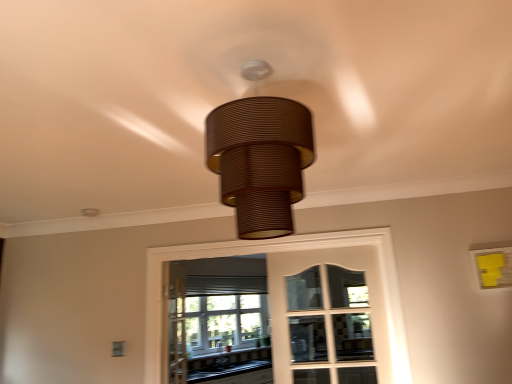
Question: From the image's perspective, is black laminate countertop at lower center located above or below matte glass bay window at center?

Choices:
 (A) above
 (B) below

Answer: (B)

Question: Based on their positions, is black laminate countertop at lower center located to the left or right of matte glass bay window at center?

Choices:
 (A) right
 (B) left

Answer: (B)

Question: Based on their relative distances, which object is farther from the black laminate countertop at lower center?

Choices:
 (A) matte glass bay window at center
 (B) white glass screen door at center
 (C) clear glass window at center
 (D) brown textured lampshade at center

Answer: (D)

Question: Based on their relative distances, which object is nearer to the matte glass bay window at center?

Choices:
 (A) clear glass window at center
 (B) white glass screen door at center
 (C) black laminate countertop at lower center
 (D) brown textured lampshade at center

Answer: (C)